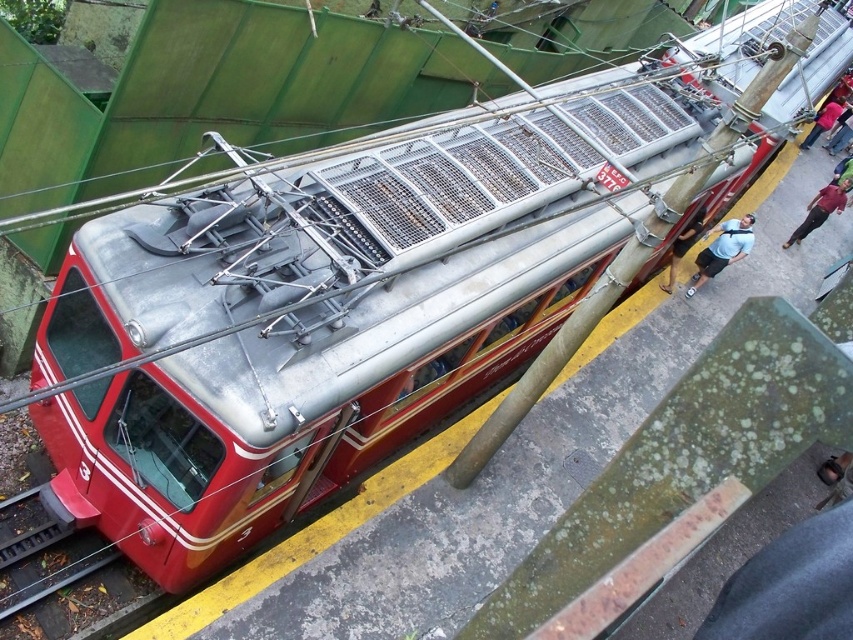
Question: Can you confirm if dark blue shirt at right is positioned below denim jacket at upper right?

Choices:
 (A) no
 (B) yes

Answer: (B)

Question: Which point is closer to the camera?

Choices:
 (A) (807, 134)
 (B) (840, 189)
 (C) (836, 131)
 (D) (741, 241)

Answer: (D)

Question: Which point appears farthest from the camera in this image?

Choices:
 (A) (836, 97)
 (B) (705, 252)

Answer: (A)

Question: In this image, where is dark blue shirt at right located relative to denim jacket at upper right?

Choices:
 (A) below
 (B) above

Answer: (A)

Question: Can you confirm if light blue shirt at center is positioned to the right of maroon fabric pants at right?

Choices:
 (A) no
 (B) yes

Answer: (A)

Question: Which object appears closest to the camera in this image?

Choices:
 (A) maroon fabric pants at right
 (B) light blue shirt at center

Answer: (B)